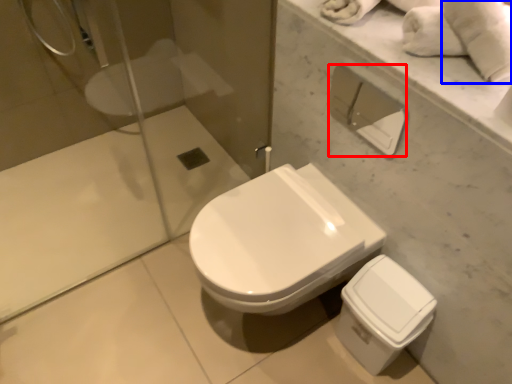
Question: Among these objects, which one is farthest to the camera, toilet paper (highlighted by a red box) or bath towel (highlighted by a blue box)?

Choices:
 (A) toilet paper
 (B) bath towel

Answer: (A)